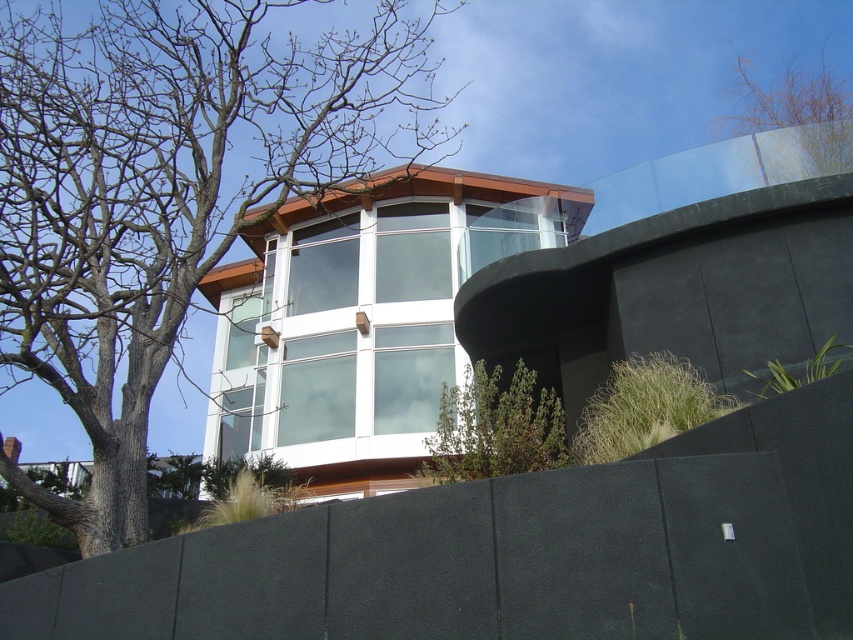
Question: Which of the following is the farthest from the observer?

Choices:
 (A) bare branches at upper right
 (B) green leafy shrub at lower center
 (C) brown leafless tree at left

Answer: (A)

Question: Which point is closer to the camera?

Choices:
 (A) (360, 339)
 (B) (521, 385)
 (C) (33, 262)
 (D) (793, 88)

Answer: (C)

Question: From the image, what is the correct spatial relationship of clear glass windows at center in relation to bare branches at upper right?

Choices:
 (A) right
 (B) left

Answer: (B)

Question: Which point is closer to the camera?

Choices:
 (A) (821, 138)
 (B) (367, 276)
 (C) (440, 422)
 (D) (165, 252)

Answer: (C)

Question: Where is brown leafless tree at left located in relation to bare branches at upper right in the image?

Choices:
 (A) left
 (B) right

Answer: (A)

Question: Considering the relative positions of brown leafless tree at left and green leafy shrub at lower center in the image provided, where is brown leafless tree at left located with respect to green leafy shrub at lower center?

Choices:
 (A) left
 (B) right

Answer: (A)